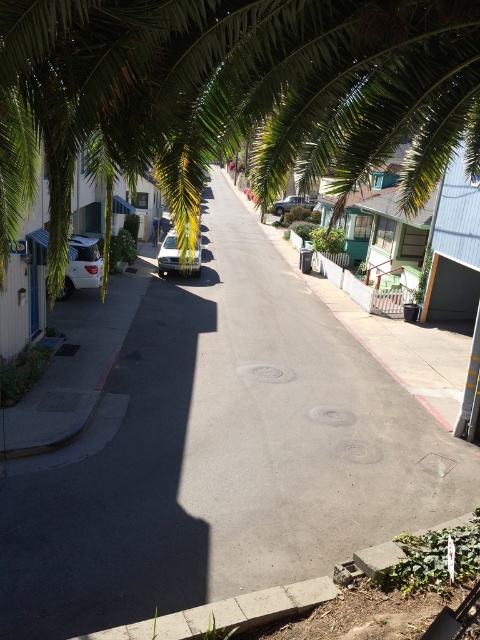
You are a delivery person trying to park your van, which is 2 meters wide, between the silver metallic car at left and the silver metallic sedan at center. Can you fit your van there?

The silver metallic car at left is narrower than the silver metallic sedan at center, but the distance between them isn